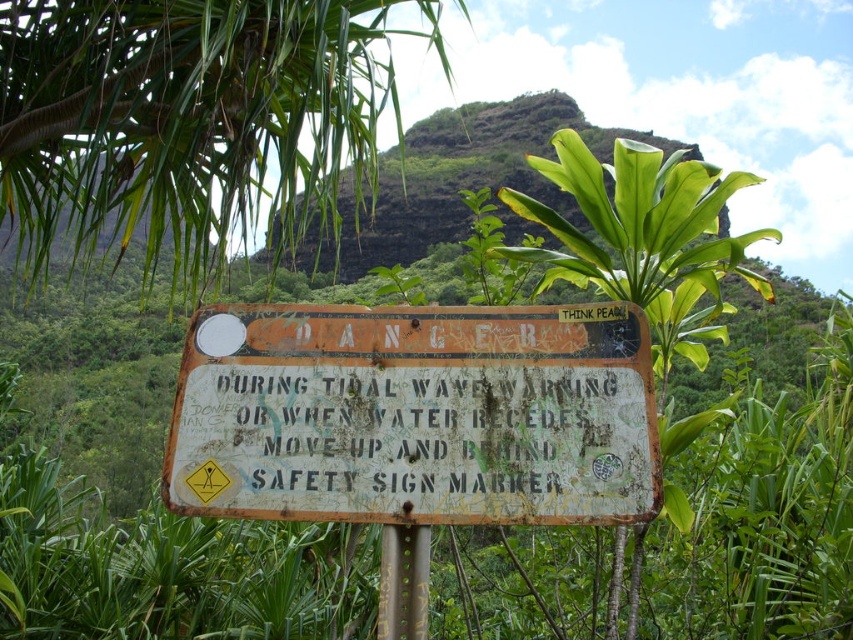
Does green rock at center have a lesser width compared to rusty metal pole at center?

In fact, green rock at center might be wider than rusty metal pole at center.

Does green rock at center appear over rusty metal pole at center?

Yes, green rock at center is above rusty metal pole at center.

Is point (462, 106) farther from camera compared to point (410, 618)?

That is True.

This screenshot has width=853, height=640. In order to click on green rock at center in this screenshot , I will do `click(466, 173)`.

Can you confirm if rusty metal sign at center is positioned below green rock at center?

Correct, rusty metal sign at center is located below green rock at center.

Based on the photo, who is lower down, rusty metal sign at center or green rock at center?

rusty metal sign at center is lower down.

Is point (238, 477) positioned after point (618, 134)?

No.

I want to click on rusty metal sign at center, so click(415, 416).

Who is lower down, rusty metal sign at center or rusty metal pole at center?

rusty metal pole at center is lower down.

Does rusty metal sign at center have a lesser height compared to rusty metal pole at center?

No, rusty metal sign at center is not shorter than rusty metal pole at center.

Locate an element on the screen. rusty metal sign at center is located at coordinates (415, 416).